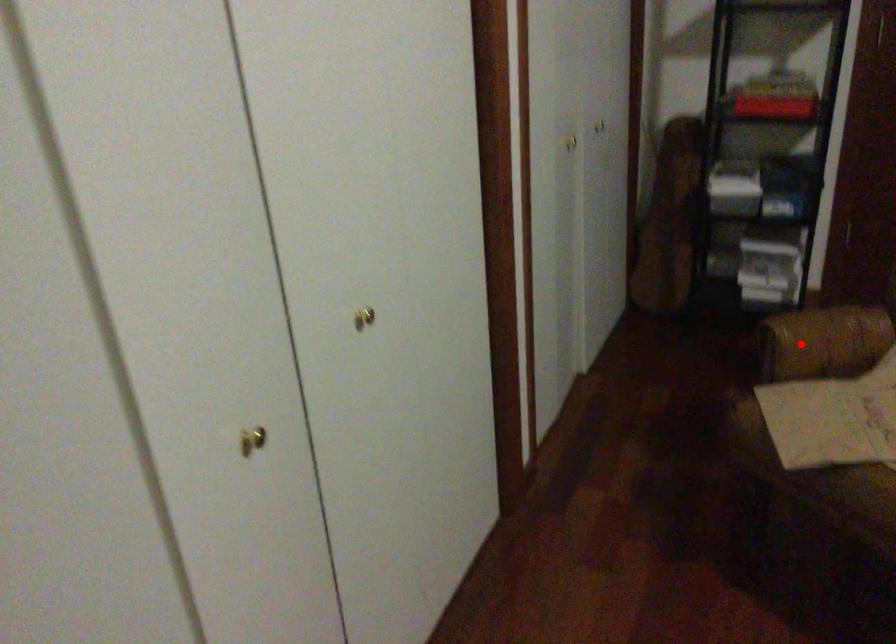
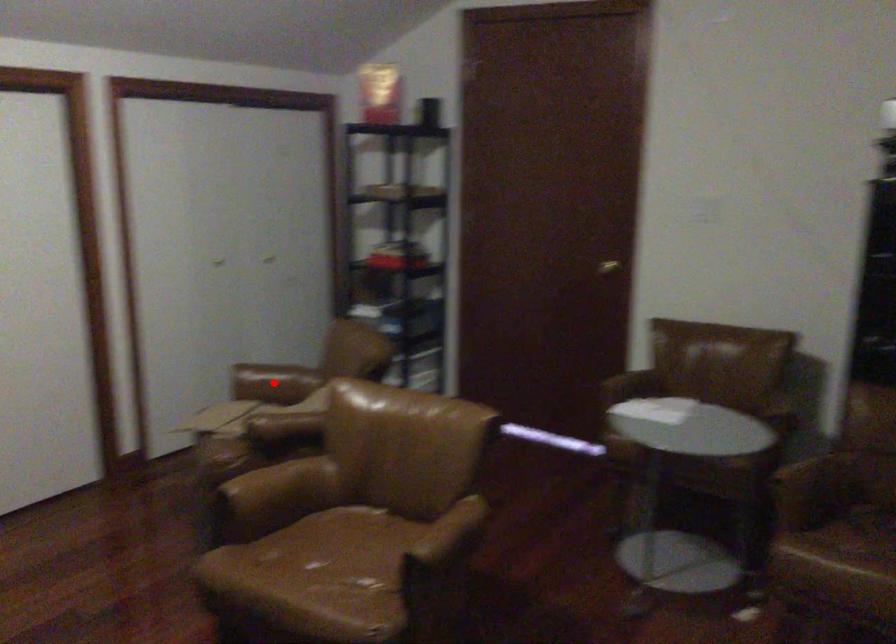
I am providing you with two images of the same scene from different viewpoints. A red point is marked on the first image and another point is marked on the second image. Is the marked point in image1 the same physical position as the marked point in image2?

Yes